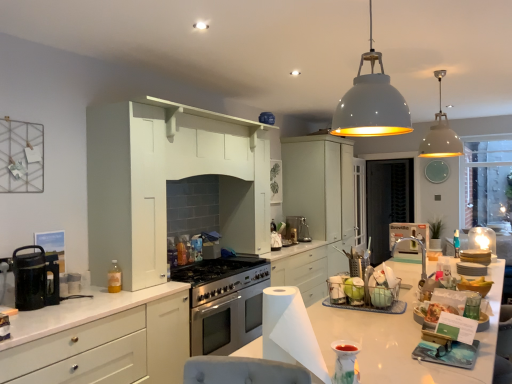
Question: Is white paper at center bigger than translucent plastic bottle at left?

Choices:
 (A) yes
 (B) no

Answer: (A)

Question: From a real-world perspective, is white paper at center below translucent plastic bottle at left?

Choices:
 (A) yes
 (B) no

Answer: (B)

Question: From the image's perspective, is white paper at center over translucent plastic bottle at left?

Choices:
 (A) yes
 (B) no

Answer: (A)

Question: Does white paper at center turn towards translucent plastic bottle at left?

Choices:
 (A) yes
 (B) no

Answer: (B)

Question: Does white paper at center have a lesser height compared to translucent plastic bottle at left?

Choices:
 (A) yes
 (B) no

Answer: (B)

Question: Is white paper at center at the right side of translucent plastic bottle at left?

Choices:
 (A) yes
 (B) no

Answer: (A)

Question: Is matte white cabinets at center, acting as the 1th cabinetry starting from the right, positioned behind black mesh screen door at center?

Choices:
 (A) no
 (B) yes

Answer: (A)

Question: Considering the relative sizes of matte white cabinets at center, acting as the 1th cabinetry starting from the right, and black mesh screen door at center in the image provided, is matte white cabinets at center, acting as the 1th cabinetry starting from the right, thinner than black mesh screen door at center?

Choices:
 (A) yes
 (B) no

Answer: (B)

Question: Is matte white cabinets at center, which is counted as the first cabinetry, starting from the back, aimed at black mesh screen door at center?

Choices:
 (A) yes
 (B) no

Answer: (B)

Question: Can you confirm if matte white cabinets at center, positioned as the second cabinetry in left-to-right order, is shorter than black mesh screen door at center?

Choices:
 (A) yes
 (B) no

Answer: (A)

Question: Considering the relative sizes of matte white cabinets at center, which is counted as the first cabinetry, starting from the back, and black mesh screen door at center in the image provided, is matte white cabinets at center, which is counted as the first cabinetry, starting from the back, taller than black mesh screen door at center?

Choices:
 (A) no
 (B) yes

Answer: (A)

Question: Is matte white cabinets at center, acting as the 1th cabinetry starting from the right, wider than black mesh screen door at center?

Choices:
 (A) no
 (B) yes

Answer: (B)

Question: Would you say white matte cabinet at left, the 2th cabinetry in the right-to-left sequence, contains white paper at center?

Choices:
 (A) yes
 (B) no

Answer: (B)